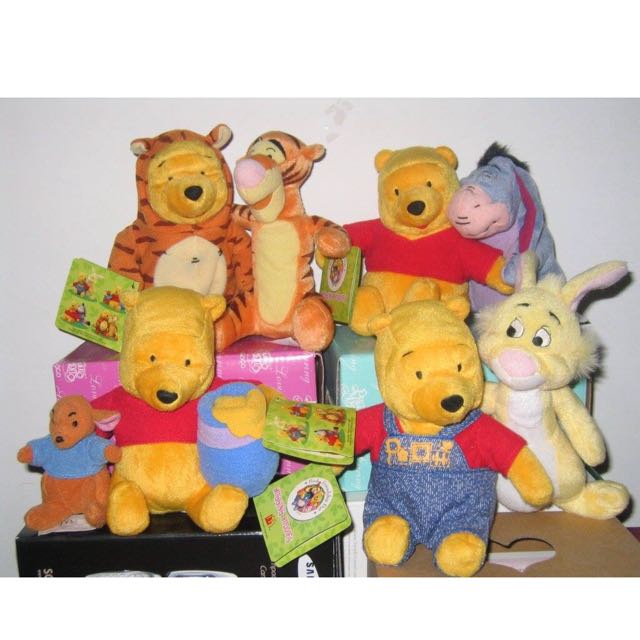
At what (x,y) coordinates should I click in order to perform the action: click on boxes. Please return your answer as a coordinate pair (x, y). The height and width of the screenshot is (640, 640). Looking at the image, I should click on (271, 362), (362, 374), (188, 550), (532, 552).